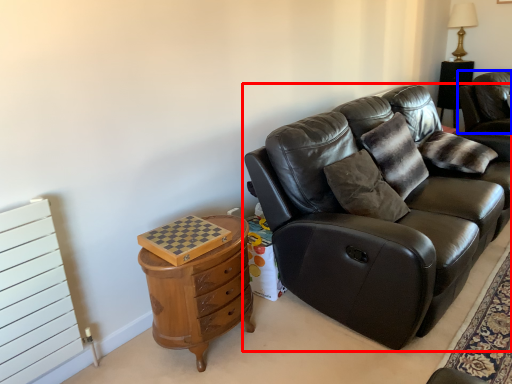
Question: Which of the following is the farthest to the observer, studio couch (highlighted by a red box) or chair (highlighted by a blue box)?

Choices:
 (A) studio couch
 (B) chair

Answer: (B)